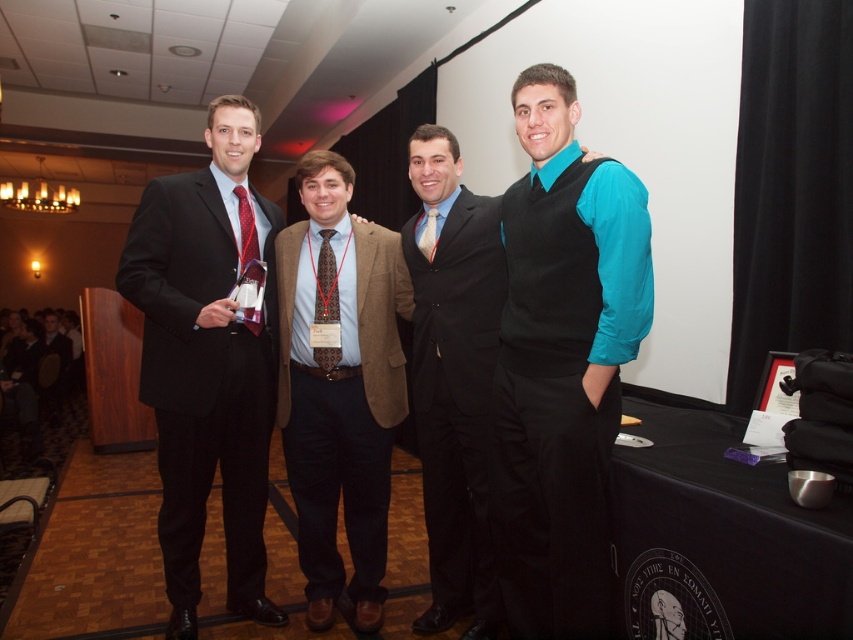
Question: Among these objects, which one is nearest to the camera?

Choices:
 (A) teal satin vest at center
 (B) black matte suit at left
 (C) shiny red tie at center

Answer: (A)

Question: Which point appears closest to the camera in this image?

Choices:
 (A) click(379, 582)
 (B) click(496, 342)

Answer: (B)

Question: Observing the image, what is the correct spatial positioning of teal satin vest at center in reference to black smooth suit at center?

Choices:
 (A) below
 (B) above

Answer: (B)

Question: Can you confirm if teal satin vest at center is positioned to the right of matte red tie at center?

Choices:
 (A) no
 (B) yes

Answer: (B)

Question: Considering the relative positions of matte black suit at center and matte red tie at center in the image provided, where is matte black suit at center located with respect to matte red tie at center?

Choices:
 (A) below
 (B) above

Answer: (A)

Question: Which object is farther from the camera taking this photo?

Choices:
 (A) brown wool blazer at center
 (B) matte red tie at center
 (C) brown textured tie at center
 (D) teal satin vest at center

Answer: (A)